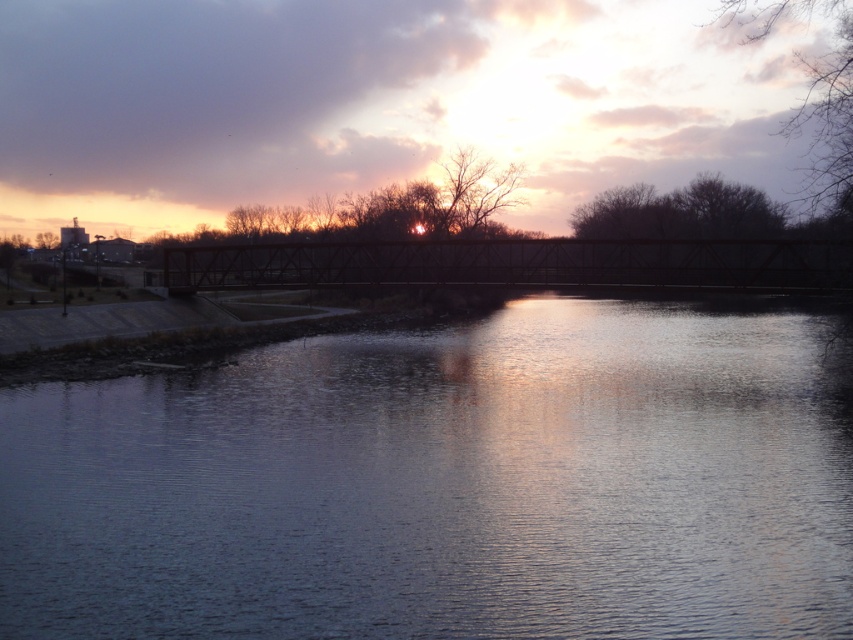
Question: Among these objects, which one is nearest to the camera?

Choices:
 (A) smooth water at center
 (B) dark brown metal bridge at center

Answer: (A)

Question: Where is smooth water at center located in relation to dark brown metal bridge at center in the image?

Choices:
 (A) above
 (B) below

Answer: (B)

Question: Considering the relative positions of smooth water at center and dark brown metal bridge at center in the image provided, where is smooth water at center located with respect to dark brown metal bridge at center?

Choices:
 (A) left
 (B) right

Answer: (B)

Question: Which point appears closest to the camera in this image?

Choices:
 (A) (24, 627)
 (B) (845, 241)

Answer: (A)

Question: In this image, where is smooth water at center located relative to dark brown metal bridge at center?

Choices:
 (A) left
 (B) right

Answer: (B)

Question: Among these points, which one is nearest to the camera?

Choices:
 (A) (259, 269)
 (B) (654, 355)

Answer: (B)